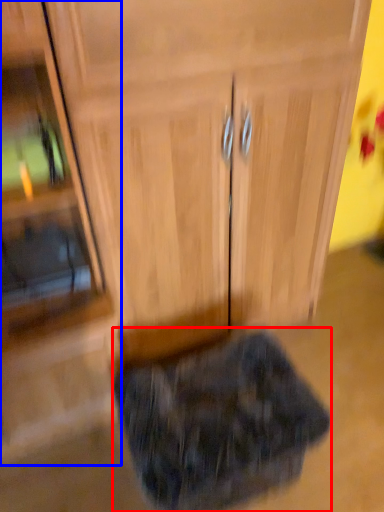
Question: Which of the following is the closest to the observer, animal (highlighted by a red box) or side cabinet (highlighted by a blue box)?

Choices:
 (A) animal
 (B) side cabinet

Answer: (B)